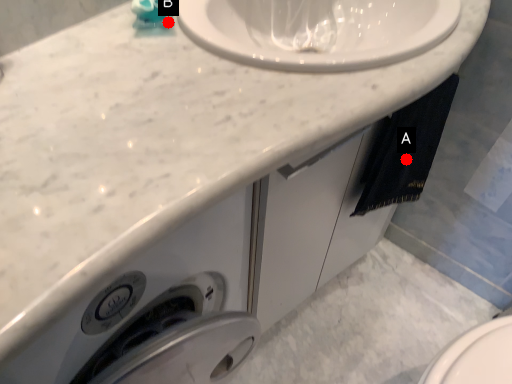
Question: Two points are circled on the image, labeled by A and B beside each circle. Which point appears farthest from the camera in this image?

Choices:
 (A) A is further
 (B) B is further

Answer: (A)